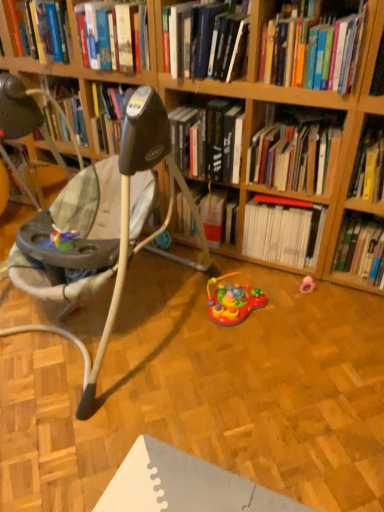
The image size is (384, 512). I want to click on vacant space to the right of pink rubber pacifier at lower right, the second toy from the left, so click(x=346, y=294).